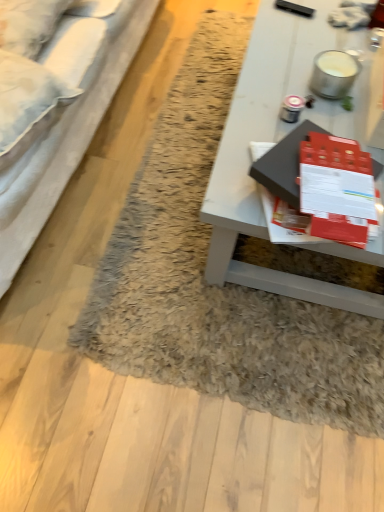
The width and height of the screenshot is (384, 512). In order to click on free location above white glossy table at center (from a real-world perspective) in this screenshot , I will do `click(324, 68)`.